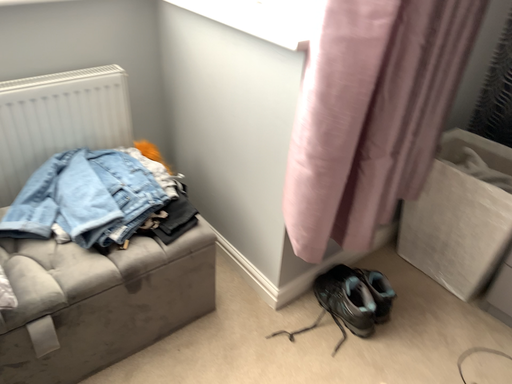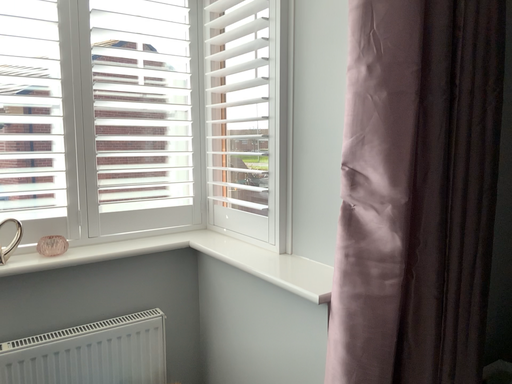
Question: How did the camera likely rotate when shooting the video?

Choices:
 (A) rotated upward
 (B) rotated downward

Answer: (A)